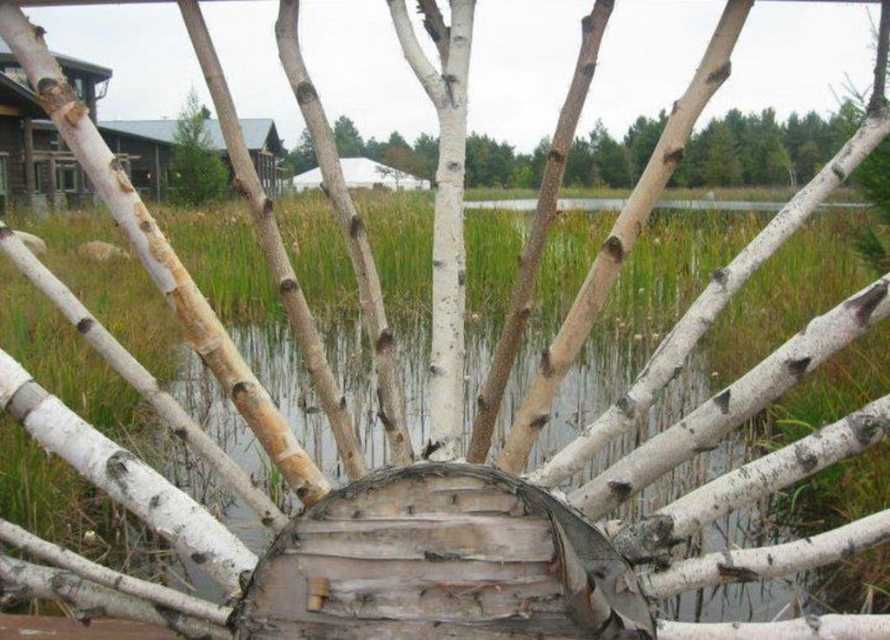
Question: Is green grass at center wider than green textured pine tree at upper left?

Choices:
 (A) yes
 (B) no

Answer: (A)

Question: Is white matte tree trunk at center bigger than green textured pine tree at upper left?

Choices:
 (A) no
 (B) yes

Answer: (B)

Question: Can you confirm if green grass at center is positioned to the right of green textured pine tree at upper left?

Choices:
 (A) yes
 (B) no

Answer: (A)

Question: Estimate the real-world distances between objects in this image. Which object is closer to the green textured pine tree at upper left?

Choices:
 (A) green grass at center
 (B) wooden cabin at upper left
 (C) white matte tree trunk at center

Answer: (B)

Question: Which point is farther from the camera taking this photo?

Choices:
 (A) (65, 577)
 (B) (167, 176)
 (C) (791, 172)
 (D) (61, 184)

Answer: (B)

Question: Which point is farther to the camera?

Choices:
 (A) white matte tree trunk at center
 (B) wooden cabin at upper left
 (C) wooden wagon wheel at center

Answer: (B)